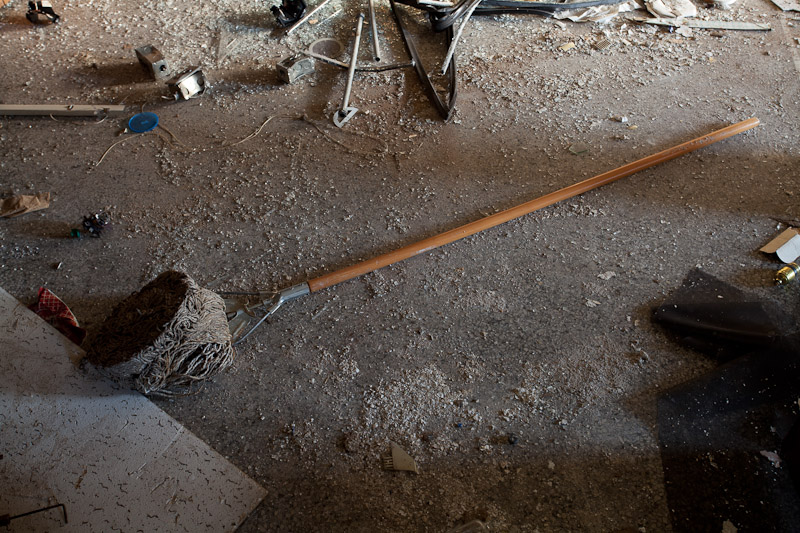
The width and height of the screenshot is (800, 533). What are the coordinates of `mop` in the screenshot? It's located at (430, 245).